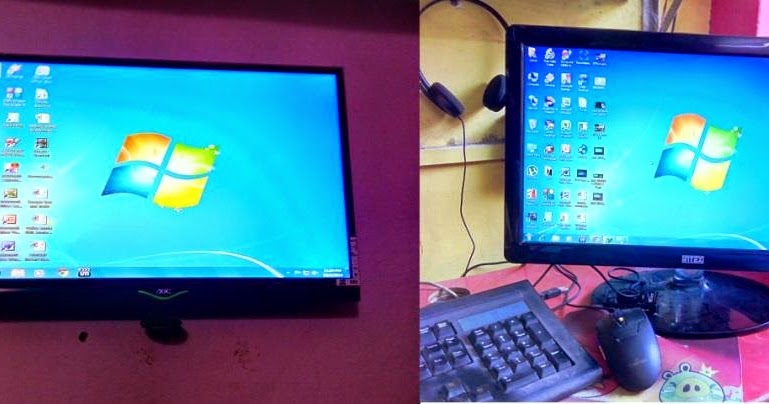
Find the location of a particular element. This screenshot has height=404, width=769. screen stand is located at coordinates (693, 302).